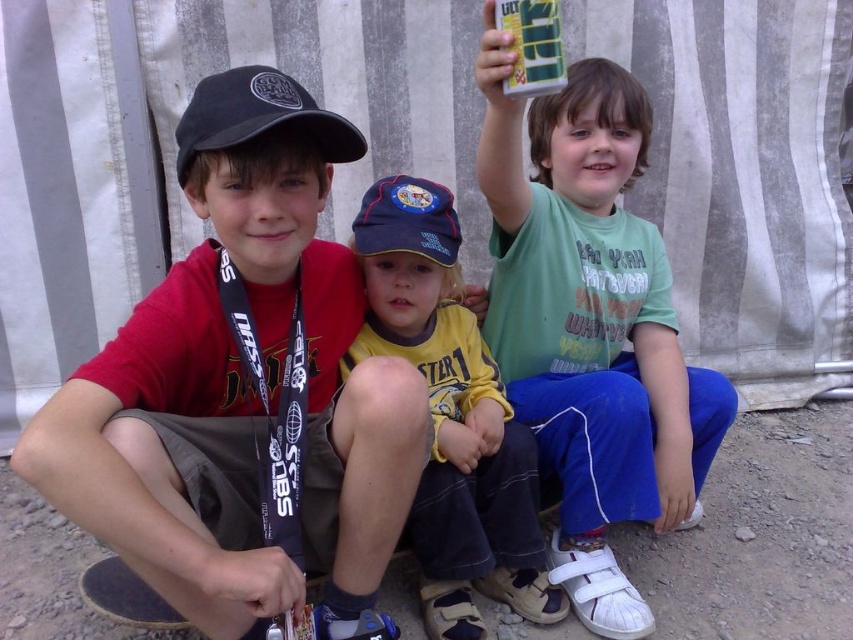
Is point (405, 413) positioned after point (257, 100)?

Yes.

What are the coordinates of `matte black cap at left` in the screenshot? It's located at (244, 388).

Identify the location of matte black cap at left. (244, 388).

Does matte black cap at left have a larger size compared to yellow jersey at center?

Yes.

This screenshot has height=640, width=853. In order to click on matte black cap at left in this screenshot , I will do `click(244, 388)`.

Who is positioned more to the right, green cotton shirt at center or yellow jersey at center?

green cotton shirt at center is more to the right.

Does point (492, 52) lie behind point (521, 436)?

No, it is in front of (521, 436).

Where is `green cotton shirt at center`? This screenshot has width=853, height=640. green cotton shirt at center is located at coordinates (590, 324).

Where is `green cotton shirt at center`? The height and width of the screenshot is (640, 853). green cotton shirt at center is located at coordinates (590, 324).